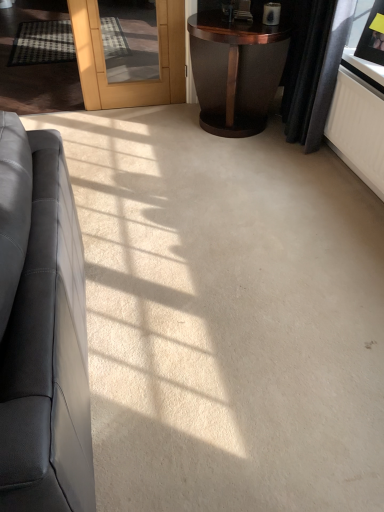
You are a GUI agent. You are given a task and a screenshot of the screen. Output one action in this format:
    pyautogui.click(x=<x>, y=<y>)
    Task: Click on the dark wood side table at upper right
    
    Given the screenshot: What is the action you would take?
    pyautogui.click(x=236, y=71)

What do you see at coordinates (236, 71) in the screenshot? I see `dark wood side table at upper right` at bounding box center [236, 71].

Measure the distance between matte black couch at left and camera.

matte black couch at left is 65.90 centimeters away from camera.

Where is `matte black picture frame at upper right`? matte black picture frame at upper right is located at coordinates (373, 36).

From the picture: Is dark wood side table at upper right outside of black velvet curtain at upper right?

Indeed, dark wood side table at upper right is completely outside black velvet curtain at upper right.

Considering the relative positions of dark wood side table at upper right and black velvet curtain at upper right in the image provided, is dark wood side table at upper right to the left of black velvet curtain at upper right from the viewer's perspective?

Yes.

Is dark wood side table at upper right wider than black velvet curtain at upper right?

Yes, dark wood side table at upper right is wider than black velvet curtain at upper right.

Based on their sizes in the image, would you say dark wood side table at upper right is bigger or smaller than black velvet curtain at upper right?

Clearly, dark wood side table at upper right is larger in size than black velvet curtain at upper right.

Can you confirm if dark wood side table at upper right is thinner than matte black picture frame at upper right?

In fact, dark wood side table at upper right might be wider than matte black picture frame at upper right.

From their relative heights in the image, would you say dark wood side table at upper right is taller or shorter than matte black picture frame at upper right?

In the image, dark wood side table at upper right appears to be taller than matte black picture frame at upper right.

Is the depth of dark wood side table at upper right greater than that of matte black picture frame at upper right?

That is True.

From the image's perspective, does black velvet curtain at upper right appear higher than dark wood side table at upper right?

No, from the image's perspective, black velvet curtain at upper right is not over dark wood side table at upper right.

From a real-world perspective, is black velvet curtain at upper right physically located above or below dark wood side table at upper right?

Clearly, from a real-world perspective, black velvet curtain at upper right is above dark wood side table at upper right.

Is black velvet curtain at upper right looking in the opposite direction of dark wood side table at upper right?

That's not correct — black velvet curtain at upper right is not looking away from dark wood side table at upper right.

Can you confirm if matte black couch at left is smaller than dark wood side table at upper right?

No.

Could you tell me if matte black couch at left is turned towards dark wood side table at upper right?

No, matte black couch at left is not turned towards dark wood side table at upper right.

What's the angular difference between matte black couch at left and dark wood side table at upper right's facing directions?

The angle between the facing direction of matte black couch at left and the facing direction of dark wood side table at upper right is 88.9 degrees.

In the scene shown: Between matte black couch at left and dark wood side table at upper right, which one has more height?

With more height is matte black couch at left.

Is point (15, 338) closer to viewer compared to point (311, 76)?

That is True.

Is matte black couch at left positioned with its back to black velvet curtain at upper right?

That's not correct — matte black couch at left is not looking away from black velvet curtain at upper right.

Is matte black couch at left wider or thinner than black velvet curtain at upper right?

matte black couch at left is wider than black velvet curtain at upper right.

From a real-world perspective, is matte black couch at left under black velvet curtain at upper right?

Yes, from a real-world perspective, matte black couch at left is below black velvet curtain at upper right.

Would you say matte black couch at left is to the left or to the right of matte black picture frame at upper right in the picture?

Clearly, matte black couch at left is on the left of matte black picture frame at upper right in the image.

Is there a large distance between matte black couch at left and matte black picture frame at upper right?

matte black couch at left is far away from matte black picture frame at upper right.

From the image's perspective, is matte black couch at left positioned above or below matte black picture frame at upper right?

matte black couch at left is situated lower than matte black picture frame at upper right in the image.

From the picture: From a real-world perspective, who is located lower, black velvet curtain at upper right or matte black picture frame at upper right?

black velvet curtain at upper right.

Does black velvet curtain at upper right have a lesser height compared to matte black picture frame at upper right?

No, black velvet curtain at upper right is not shorter than matte black picture frame at upper right.

Is matte black picture frame at upper right completely or partially inside black velvet curtain at upper right?

That's incorrect, matte black picture frame at upper right is not inside black velvet curtain at upper right.

Locate an element on the screen. table below the black velvet curtain at upper right (from a real-world perspective) is located at coordinates (236, 71).

The width and height of the screenshot is (384, 512). In the image, there is a matte black picture frame at upper right. Identify the location of table above it (from the image's perspective). (236, 71).

Estimate the real-world distances between objects in this image. Which object is further from matte black couch at left, matte black picture frame at upper right or dark wood side table at upper right?

Based on the image, matte black picture frame at upper right appears to be further to matte black couch at left.

When comparing their distances from black velvet curtain at upper right, does matte black couch at left or matte black picture frame at upper right seem closer?

matte black picture frame at upper right is closer to black velvet curtain at upper right.

Considering their positions, is matte black couch at left positioned closer to dark wood side table at upper right than matte black picture frame at upper right?

matte black picture frame at upper right is closer to dark wood side table at upper right.

Looking at the image, which one is located further to matte black picture frame at upper right, black velvet curtain at upper right or matte black couch at left?

matte black couch at left is further to matte black picture frame at upper right.

Estimate the real-world distances between objects in this image. Which object is further from dark wood side table at upper right, matte black picture frame at upper right or black velvet curtain at upper right?

matte black picture frame at upper right is further to dark wood side table at upper right.

Estimate the real-world distances between objects in this image. Which object is further from matte black picture frame at upper right, black velvet curtain at upper right or dark wood side table at upper right?

dark wood side table at upper right lies further to matte black picture frame at upper right than the other object.

Estimate the real-world distances between objects in this image. Which object is further from black velvet curtain at upper right, dark wood side table at upper right or matte black couch at left?

matte black couch at left is positioned further to the anchor black velvet curtain at upper right.

Looking at the image, which one is located further to matte black couch at left, black velvet curtain at upper right or matte black picture frame at upper right?

Based on the image, matte black picture frame at upper right appears to be further to matte black couch at left.

You are a GUI agent. You are given a task and a screenshot of the screen. Output one action in this format:
    pyautogui.click(x=<x>, y=<y>)
    Task: Click on the picture frame positioned between matte black couch at left and black velvet curtain at upper right from near to far
    This screenshot has width=384, height=512.
    Given the screenshot: What is the action you would take?
    coord(373,36)

You are a GUI agent. You are given a task and a screenshot of the screen. Output one action in this format:
    pyautogui.click(x=<x>, y=<y>)
    Task: Click on the picture frame between matte black couch at left and dark wood side table at upper right in the front-back direction
    
    Given the screenshot: What is the action you would take?
    pyautogui.click(x=373, y=36)

Locate an element on the screen. This screenshot has width=384, height=512. curtain located between matte black couch at left and dark wood side table at upper right in the depth direction is located at coordinates (318, 71).

Image resolution: width=384 pixels, height=512 pixels. What are the coordinates of `curtain between dark wood side table at upper right and matte black picture frame at upper right in the horizontal direction` in the screenshot? It's located at (318, 71).